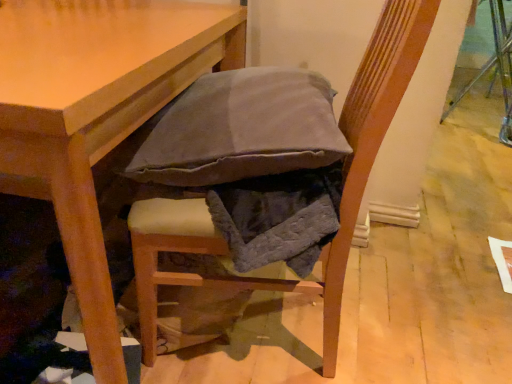
Question: Can textured fabric cushion at center be found inside light brown wooden table at center?

Choices:
 (A) yes
 (B) no

Answer: (B)

Question: From the image's perspective, would you say light brown wooden table at center is positioned over textured fabric cushion at center?

Choices:
 (A) no
 (B) yes

Answer: (B)

Question: Does light brown wooden table at center appear on the right side of textured fabric cushion at center?

Choices:
 (A) no
 (B) yes

Answer: (A)

Question: Can you confirm if light brown wooden table at center is bigger than textured fabric cushion at center?

Choices:
 (A) no
 (B) yes

Answer: (B)

Question: Can you confirm if light brown wooden table at center is thinner than textured fabric cushion at center?

Choices:
 (A) no
 (B) yes

Answer: (A)

Question: Can you confirm if light brown wooden table at center is shorter than textured fabric cushion at center?

Choices:
 (A) no
 (B) yes

Answer: (B)

Question: Considering the relative sizes of textured fabric cushion at center and light brown wooden table at center in the image provided, is textured fabric cushion at center smaller than light brown wooden table at center?

Choices:
 (A) yes
 (B) no

Answer: (A)

Question: Would you say textured fabric cushion at center is outside light brown wooden table at center?

Choices:
 (A) no
 (B) yes

Answer: (B)

Question: From a real-world perspective, is textured fabric cushion at center physically above light brown wooden table at center?

Choices:
 (A) no
 (B) yes

Answer: (B)

Question: Is textured fabric cushion at center at the left side of light brown wooden table at center?

Choices:
 (A) yes
 (B) no

Answer: (B)

Question: From the image's perspective, does textured fabric cushion at center appear lower than light brown wooden table at center?

Choices:
 (A) yes
 (B) no

Answer: (A)

Question: Would you say light brown wooden table at center is part of textured fabric cushion at center's contents?

Choices:
 (A) yes
 (B) no

Answer: (B)

Question: Would you say light brown wooden table at center is to the left or to the right of textured fabric cushion at center in the picture?

Choices:
 (A) left
 (B) right

Answer: (A)